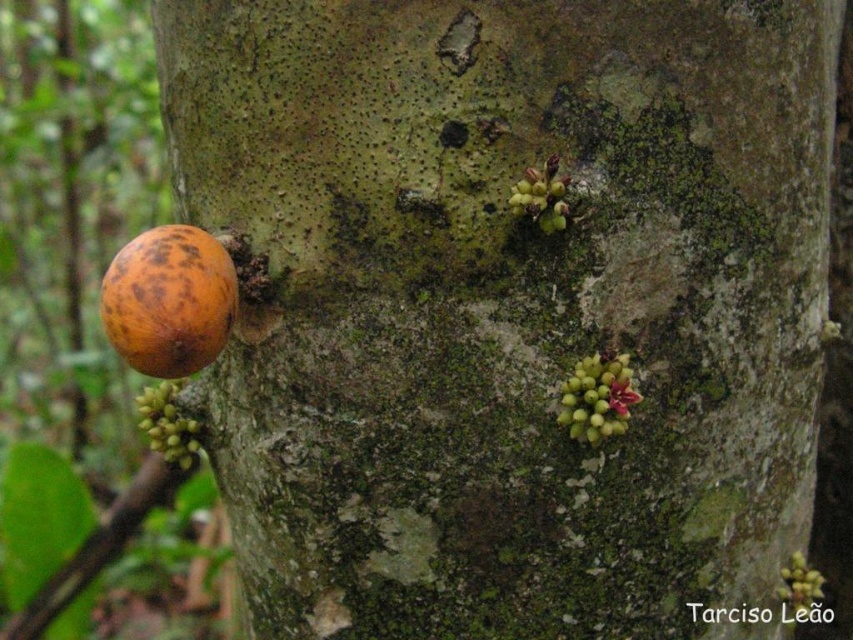
Who is more distant from viewer, (155, 259) or (556, 177)?

The point (556, 177) is more distant.

Describe the element at coordinates (169, 300) in the screenshot. I see `rotten orange fruit at left` at that location.

Locate an element on the screen. rotten orange fruit at left is located at coordinates (169, 300).

Does point (137, 250) come farther from viewer compared to point (602, 428)?

No.

Where is `rotten orange fruit at left`? The width and height of the screenshot is (853, 640). rotten orange fruit at left is located at coordinates (169, 300).

Is point (572, 404) positioned before point (521, 211)?

No.

Can you confirm if green matte cluster at upper right is smaller than green matte cluster at upper center?

Actually, green matte cluster at upper right might be larger than green matte cluster at upper center.

Between point (601, 376) and point (529, 193), which one is positioned in front?

Point (529, 193) is in front.

Find the location of a particular element. This screenshot has height=640, width=853. green matte cluster at upper right is located at coordinates (596, 397).